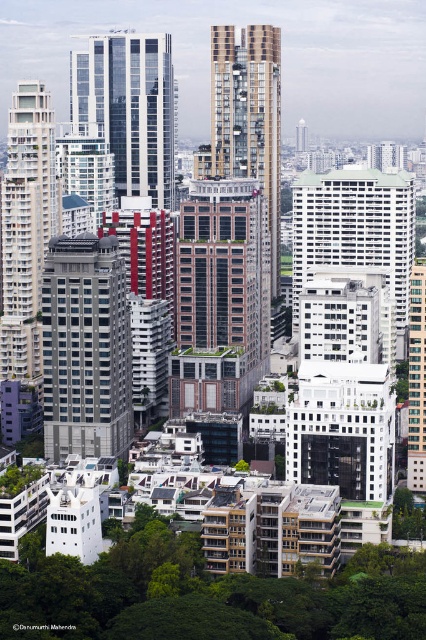
Which is below, brown brick building at center or gold textured building at center?

brown brick building at center is below.

This screenshot has height=640, width=426. Find the location of `brown brick building at center`. brown brick building at center is located at coordinates (221, 296).

The image size is (426, 640). What do you see at coordinates (221, 296) in the screenshot? I see `brown brick building at center` at bounding box center [221, 296].

The image size is (426, 640). Find the location of `brown brick building at center`. brown brick building at center is located at coordinates (221, 296).

In the scene shown: Who is more distant from viewer, (140, 141) or (271, 141)?

The point (271, 141) is more distant.

Does glassy reflective building at center lie behind gold textured building at center?

Yes, it is behind gold textured building at center.

Does point (89, 131) come behind point (245, 83)?

No, (89, 131) is closer to viewer.

Identify the location of glassy reflective building at center. (129, 108).

Can you confirm if white glossy building at left is positioned to the left of gold textured building at center?

Indeed, white glossy building at left is positioned on the left side of gold textured building at center.

Can you confirm if white glossy building at left is positioned below gold textured building at center?

Yes.

The height and width of the screenshot is (640, 426). I want to click on white glossy building at left, so click(x=25, y=227).